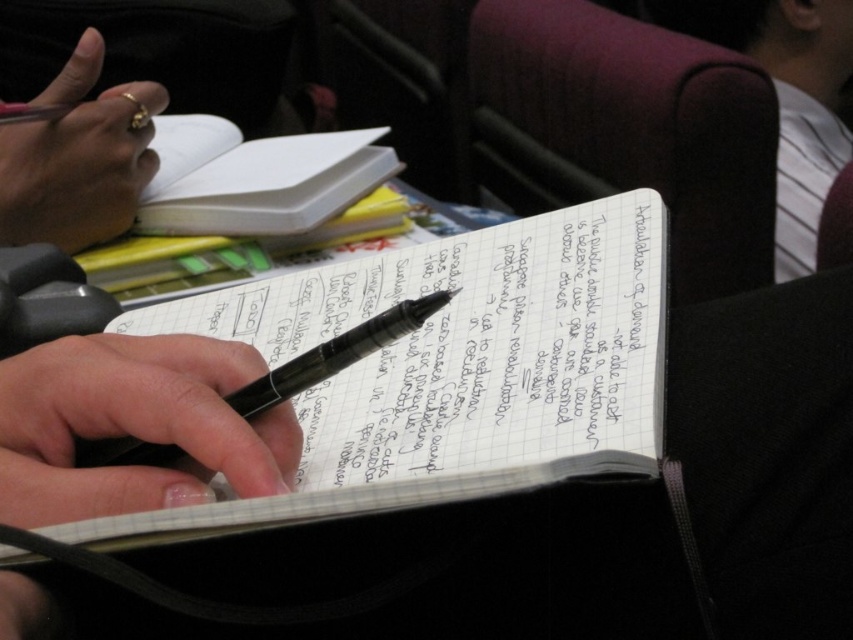
You are organizing a stationery set and need to place the white lined notebook at center and the black matte pen at center into a vertical case. Which object should be placed first to fit both items vertically?

The white lined notebook at center has a greater height compared to the black matte pen at center, so you should place the white lined notebook at center first to ensure both items fit vertically in the case.

You are trying to locate the point with coordinates (x=448, y=369) in the image. Based on the scene description, where would this point be located?

The point is on the white lined notebook at center.

You have two notebooks in front of you, the white lined notebook at center and the white paper notebook at upper center. Which one is wider?

Answer: The white lined notebook at center is wider than the white paper notebook at upper center.